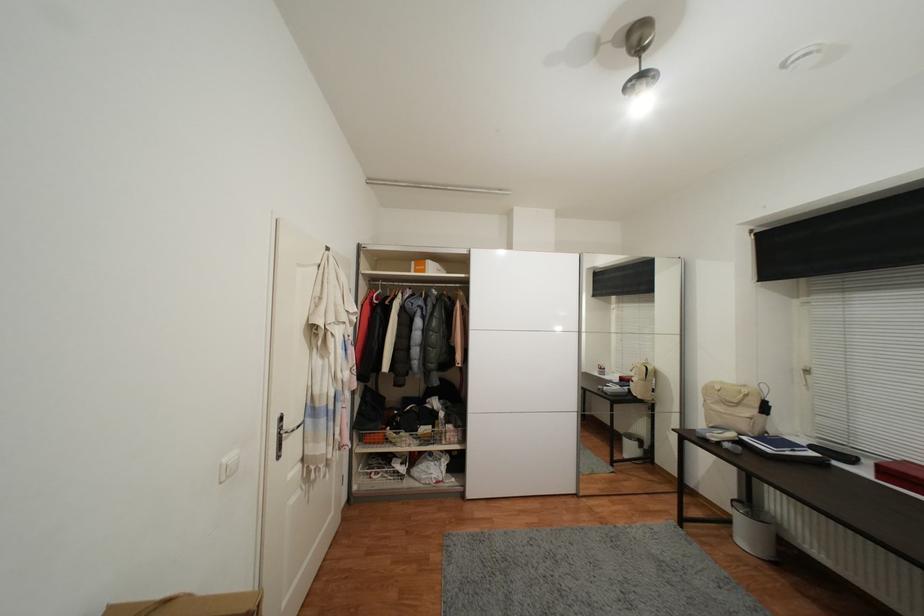
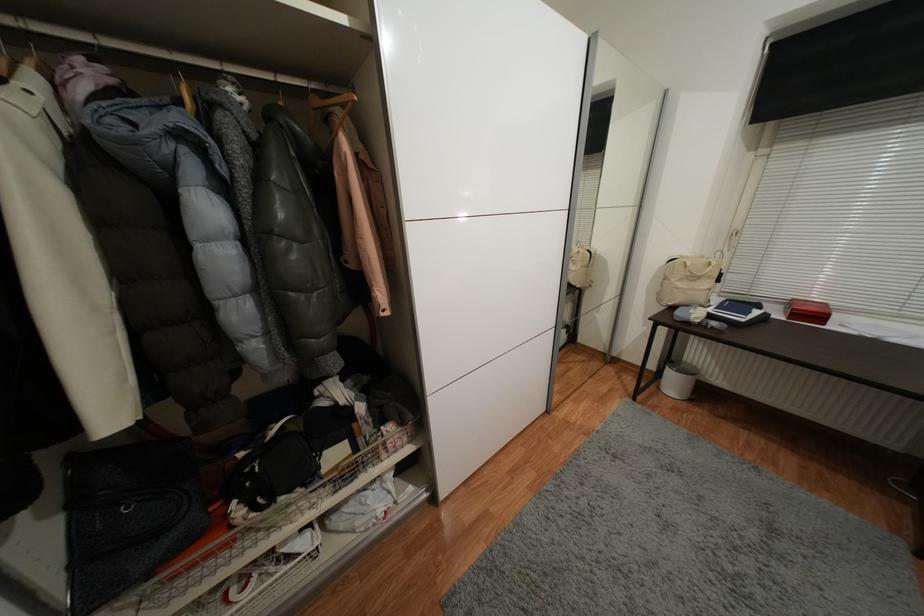
Find the pixel in the second image that matches point (646, 402) in the first image.

(582, 291)